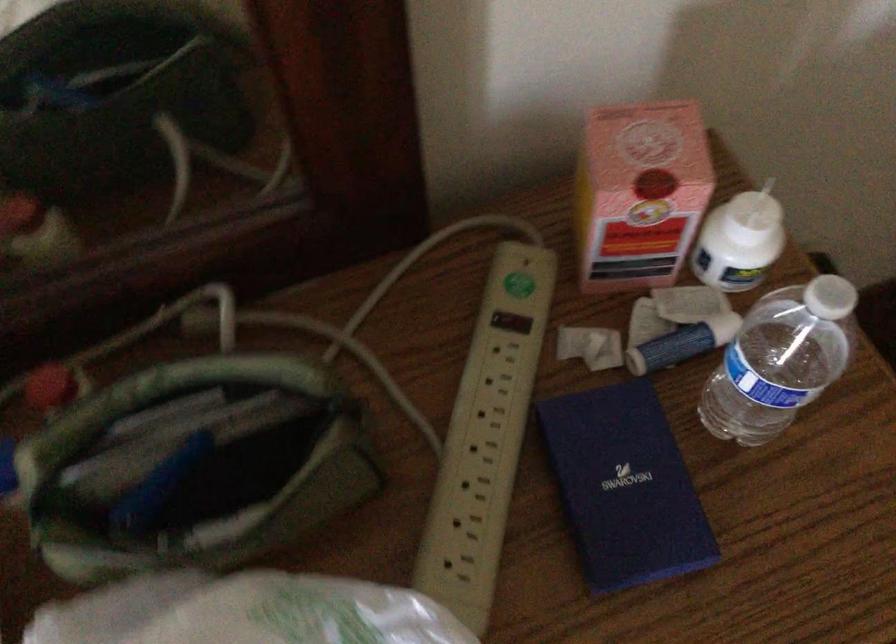
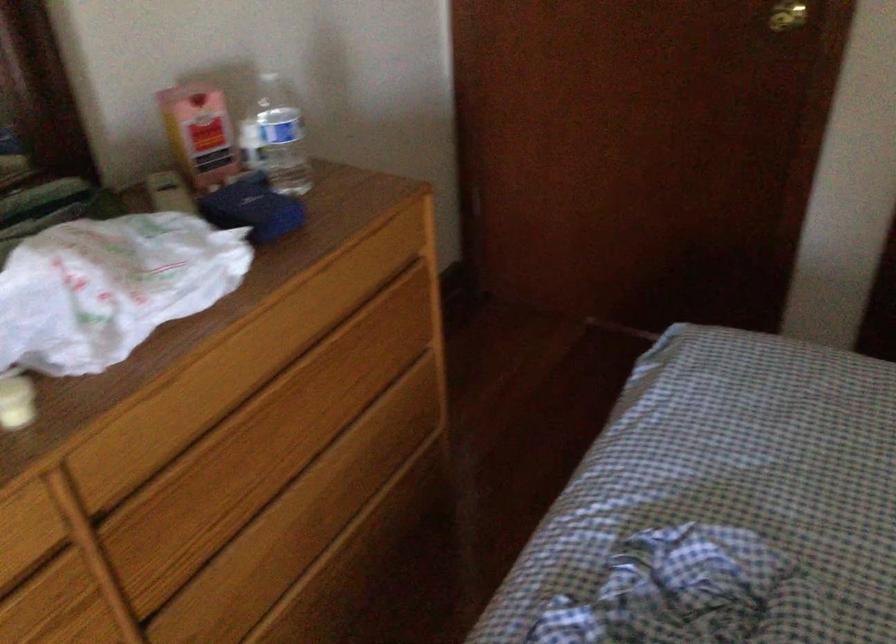
Where in the second image is the point corresponding to [765,398] from the first image?

(276, 138)